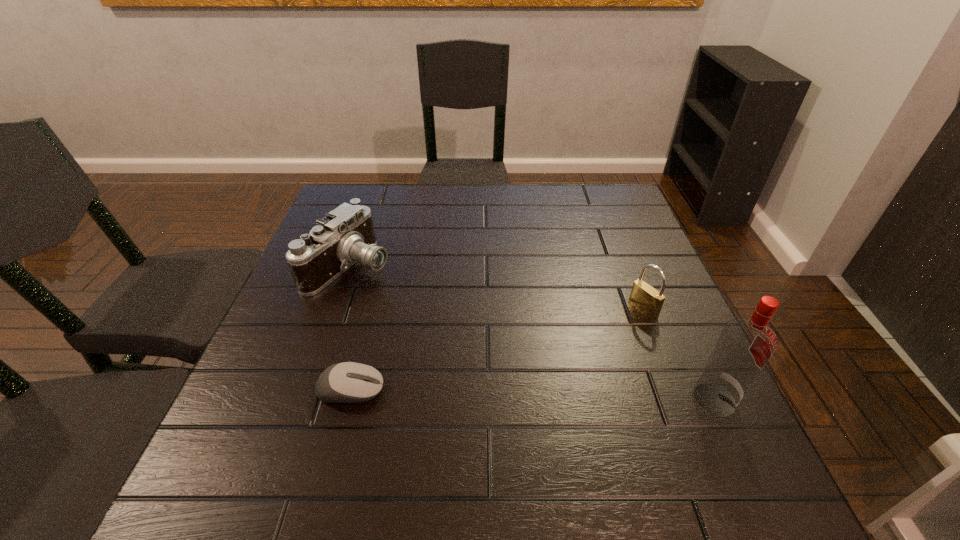
The image size is (960, 540). I want to click on object present at the near right corner, so point(746,344).

Locate an element on the screen. This screenshot has height=540, width=960. vacant space at the far edge of the desktop is located at coordinates (531, 213).

I want to click on free spot at the near edge of the desktop, so tap(592, 422).

This screenshot has height=540, width=960. I want to click on free spot at the left edge of the desktop, so click(x=342, y=326).

Locate an element on the screen. vacant region at the right edge is located at coordinates point(592,228).

This screenshot has height=540, width=960. What are the coordinates of `vacant space at the far left corner of the desktop` in the screenshot? It's located at (380, 187).

Locate an element on the screen. This screenshot has width=960, height=540. free spot at the far right corner of the desktop is located at coordinates (612, 200).

At what (x,y) coordinates should I click in order to perform the action: click on free space between the second farthest object and the camera. Please return your answer as a coordinate pair (x, y). This screenshot has height=540, width=960. Looking at the image, I should click on (496, 288).

What are the coordinates of `vacant area that lies between the farthest object and the computer equipment` in the screenshot? It's located at (350, 328).

This screenshot has height=540, width=960. What are the coordinates of `free space that is in between the padlock and the shortest object` in the screenshot? It's located at (497, 349).